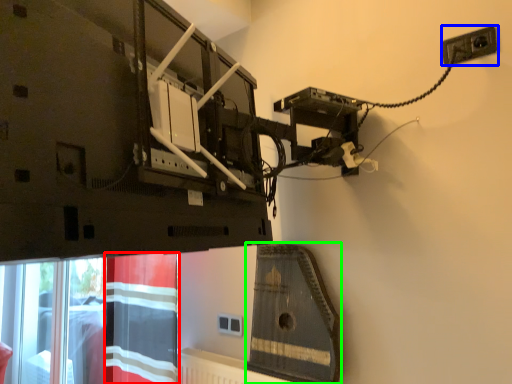
Question: Which object is positioned closest to curtain (highlighted by a red box)? Select from power plugs and sockets (highlighted by a blue box) and instrument (highlighted by a green box).

Choices:
 (A) power plugs and sockets
 (B) instrument

Answer: (B)